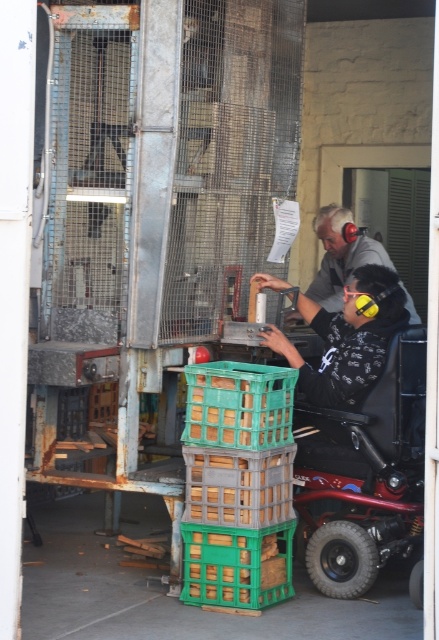
Question: Which point is closer to the camera?

Choices:
 (A) (352, 476)
 (B) (374, 246)

Answer: (A)

Question: Which point is farther from the camera taking this photo?

Choices:
 (A) (334, 253)
 (B) (334, 504)

Answer: (A)

Question: Does red metallic wheelchair at lower right have a lesser width compared to gray fabric shirt at upper right?

Choices:
 (A) yes
 (B) no

Answer: (B)

Question: Does red metallic wheelchair at lower right appear over gray fabric shirt at upper right?

Choices:
 (A) no
 (B) yes

Answer: (A)

Question: Can you confirm if red metallic wheelchair at lower right is positioned to the left of gray fabric shirt at upper right?

Choices:
 (A) yes
 (B) no

Answer: (B)